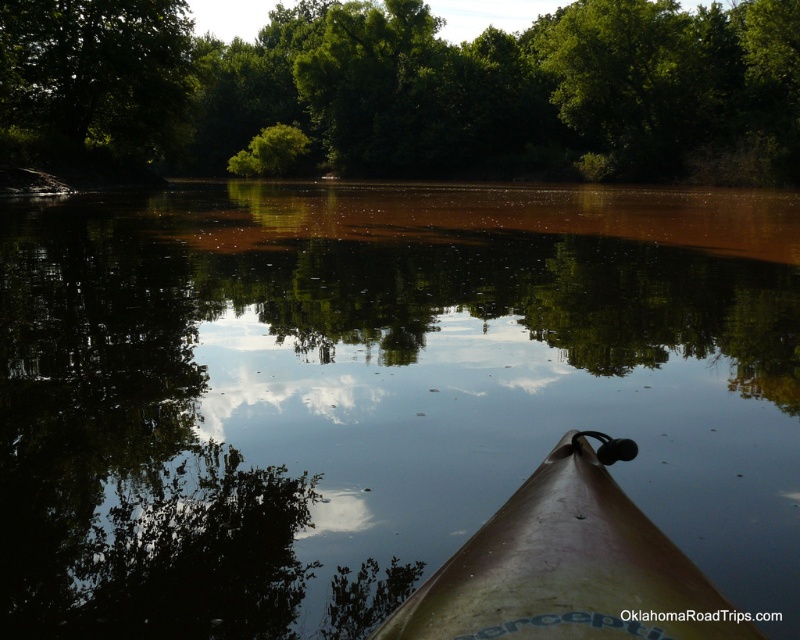
You are in a kayak on a calm river and want to know if there is enough space to maneuver around the green leafy tree at upper left without hitting the brown matte kayak at center. Can you fit through the space between them?

The brown matte kayak at center occupies less space than the green leafy tree at upper left, so there should be enough space to maneuver around the green leafy tree at upper left without hitting the brown matte kayak at center.

You are in a kayak on a calm river and want to paddle towards the smooth brown water at center. Which direction should you paddle relative to the brown matte kayak at center?

The smooth brown water at center is to the right of the brown matte kayak at center, so you should paddle to the right to reach it.

Looking at this image, you are kayaking on a calm river and want to reach the green leafy tree at upper center from the brown matte kayak at center. Based on the distance between them, can you estimate how long it would take if you paddle at a steady speed of 3 feet per second?

The distance between the green leafy tree at upper center and the brown matte kayak at center is 259.20 feet. At a steady speed of 3 feet per second, it would take approximately 86.4 seconds, which is roughly 1 minute and 26 seconds, to reach the tree.